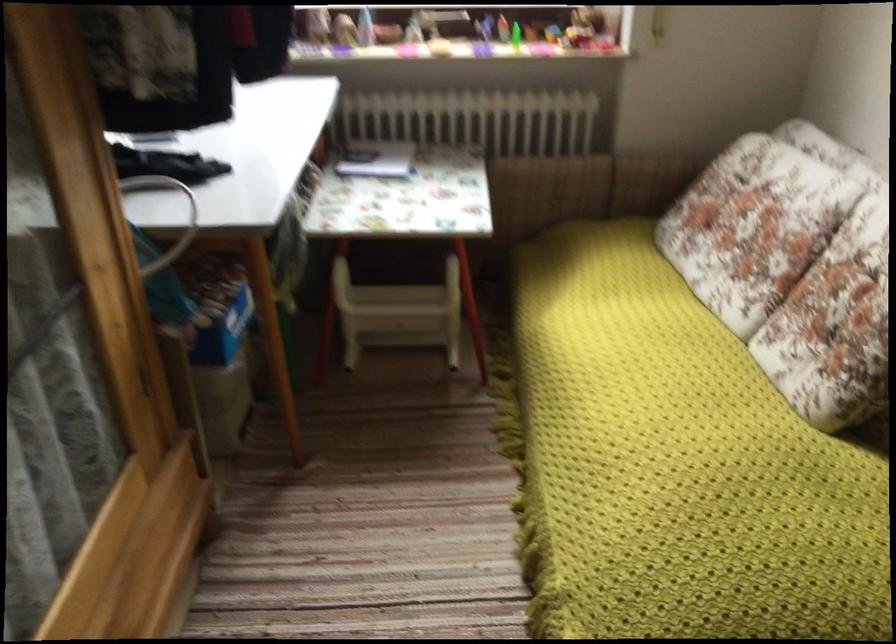
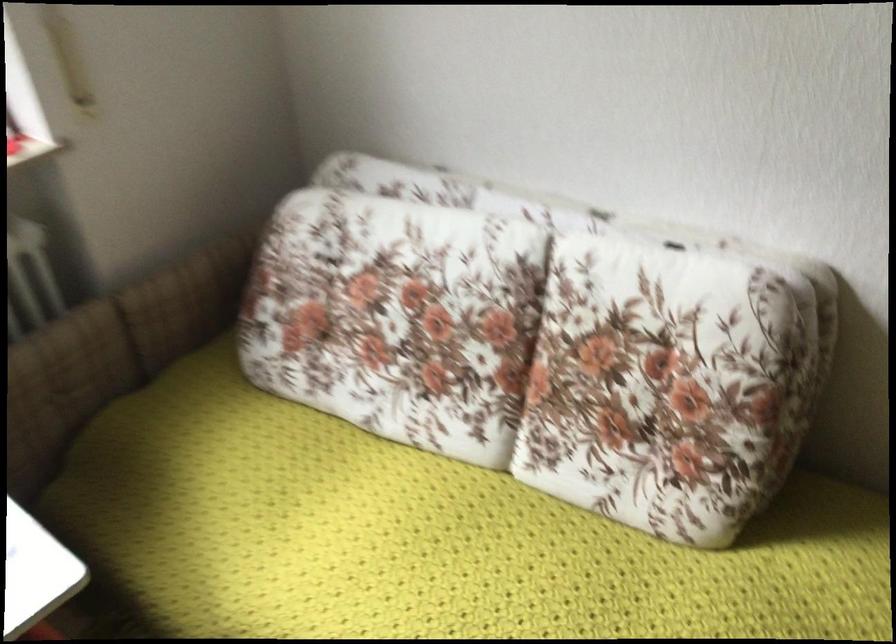
In the second image, find the point that corresponds to (656,333) in the first image.

(429, 538)